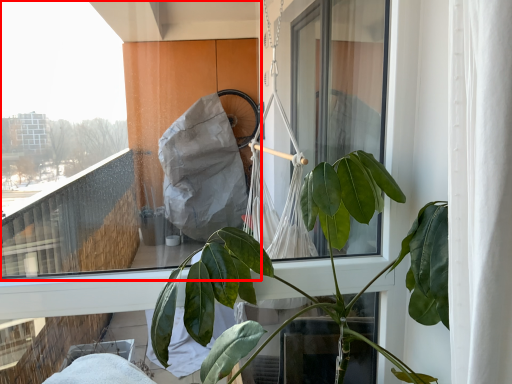
Question: From the image's perspective, what is the correct spatial positioning of window (annotated by the red box) in reference to houseplant?

Choices:
 (A) above
 (B) below

Answer: (A)